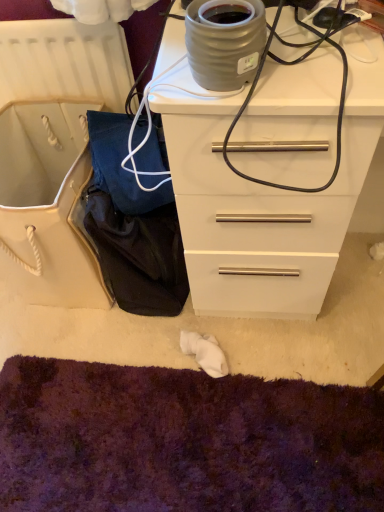
Question: Is white glossy chest of drawers at upper right at the back of matte gray ceramic pot at upper center?

Choices:
 (A) yes
 (B) no

Answer: (B)

Question: Is white glossy chest of drawers at upper right located within matte gray ceramic pot at upper center?

Choices:
 (A) yes
 (B) no

Answer: (B)

Question: Is matte gray ceramic pot at upper center not within white glossy chest of drawers at upper right?

Choices:
 (A) no
 (B) yes

Answer: (B)

Question: Is the position of matte gray ceramic pot at upper center more distant than that of white glossy chest of drawers at upper right?

Choices:
 (A) no
 (B) yes

Answer: (B)

Question: From a real-world perspective, is matte gray ceramic pot at upper center positioned under white glossy chest of drawers at upper right based on gravity?

Choices:
 (A) yes
 (B) no

Answer: (B)

Question: In terms of width, does purple shaggy carpet at lower center look wider or thinner when compared to white glossy chest of drawers at upper right?

Choices:
 (A) wide
 (B) thin

Answer: (A)

Question: Looking at the image, does purple shaggy carpet at lower center seem bigger or smaller compared to white glossy chest of drawers at upper right?

Choices:
 (A) small
 (B) big

Answer: (A)

Question: Is purple shaggy carpet at lower center to the left or to the right of white glossy chest of drawers at upper right in the image?

Choices:
 (A) right
 (B) left

Answer: (B)

Question: In the image, is purple shaggy carpet at lower center positioned in front of or behind white glossy chest of drawers at upper right?

Choices:
 (A) behind
 (B) front

Answer: (A)

Question: Is purple shaggy carpet at lower center taller or shorter than matte gray ceramic pot at upper center?

Choices:
 (A) tall
 (B) short

Answer: (B)

Question: From the image's perspective, is purple shaggy carpet at lower center positioned above or below matte gray ceramic pot at upper center?

Choices:
 (A) above
 (B) below

Answer: (B)

Question: Considering the positions of purple shaggy carpet at lower center and matte gray ceramic pot at upper center in the image, is purple shaggy carpet at lower center wider or thinner than matte gray ceramic pot at upper center?

Choices:
 (A) thin
 (B) wide

Answer: (B)

Question: Do you think purple shaggy carpet at lower center is within matte gray ceramic pot at upper center, or outside of it?

Choices:
 (A) outside
 (B) inside

Answer: (A)

Question: From the image's perspective, is white glossy chest of drawers at upper right positioned above or below purple shaggy carpet at lower center?

Choices:
 (A) below
 (B) above

Answer: (B)

Question: From their relative heights in the image, would you say white glossy chest of drawers at upper right is taller or shorter than purple shaggy carpet at lower center?

Choices:
 (A) short
 (B) tall

Answer: (B)